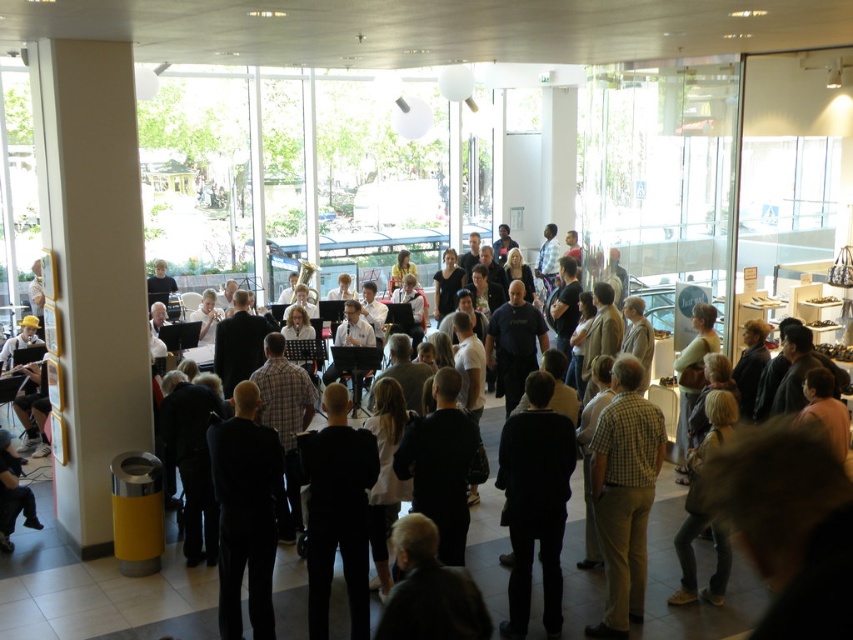
What do you see at coordinates (624, 493) in the screenshot? Image resolution: width=853 pixels, height=640 pixels. I see `checkered shirt at center` at bounding box center [624, 493].

Who is more forward, (637, 577) or (7, 486)?

Point (637, 577) is in front.

Locate an element on the screen. This screenshot has height=640, width=853. checkered shirt at center is located at coordinates (624, 493).

Is checkered shirt at center above black suit at center?

Yes, checkered shirt at center is above black suit at center.

What do you see at coordinates (624, 493) in the screenshot?
I see `checkered shirt at center` at bounding box center [624, 493].

You are a GUI agent. You are given a task and a screenshot of the screen. Output one action in this format:
    pyautogui.click(x=<x>, y=<y>)
    Task: Click on the checkered shirt at center
    This screenshot has height=640, width=853.
    Given the screenshot: What is the action you would take?
    pyautogui.click(x=624, y=493)

This screenshot has height=640, width=853. What are the coordinates of `checkered shirt at center` in the screenshot? It's located at (624, 493).

Which of these two, black suit at center or dark gray suit at lower left, stands taller?

black suit at center

Which is behind, point (277, 445) or point (26, 520)?

The point (26, 520) is behind.

Measure the distance between black suit at center and camera.

black suit at center is 5.16 meters away from camera.

You are a GUI agent. You are given a task and a screenshot of the screen. Output one action in this format:
    pyautogui.click(x=<x>, y=<y>)
    Task: Click on the black suit at center
    The height and width of the screenshot is (640, 853).
    Given the screenshot: What is the action you would take?
    pyautogui.click(x=245, y=512)